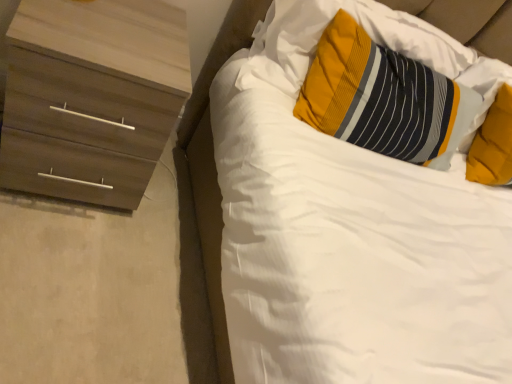
Where is `vacant region above wooden chest of drawers at left (from a real-world perspective)`? vacant region above wooden chest of drawers at left (from a real-world perspective) is located at coordinates (111, 25).